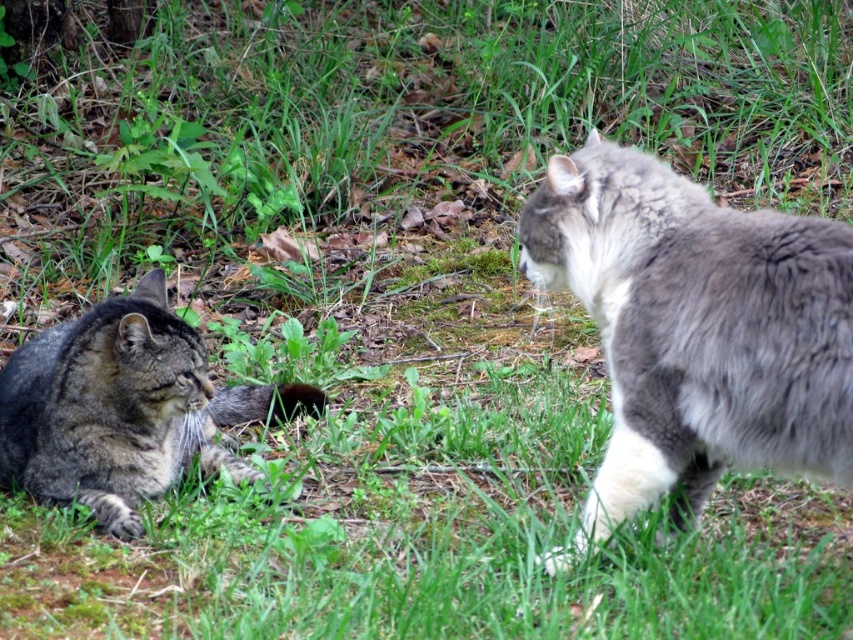
You are standing in the garden and want to take a photo of the gray fluffy cat at right. The camera has a focus point at coordinates point (695, 328). Will the gray fluffy cat at right be in focus?

The gray fluffy cat at right is located at point (695, 328), so the camera focus point at coordinates point (695, 328) will capture the gray fluffy cat at right in focus.

You are a photographer trying to capture both the gray fluffy cat at right and the tabby fur cat at left in a single frame. Based on their positions, can you determine which cat is closer to the camera?

The gray fluffy cat at right is positioned over the tabby fur cat at left, meaning it is closer to the camera.

You are a photographer trying to capture both the gray fluffy cat at right and the tabby fur cat at left in a single frame. Given their sizes, which cat might require you to adjust your camera focus more carefully to ensure clarity?

The gray fluffy cat at right is smaller than the tabby fur cat at left, so you might need to adjust the focus more carefully for the gray fluffy cat at right to ensure its smaller details are clear.